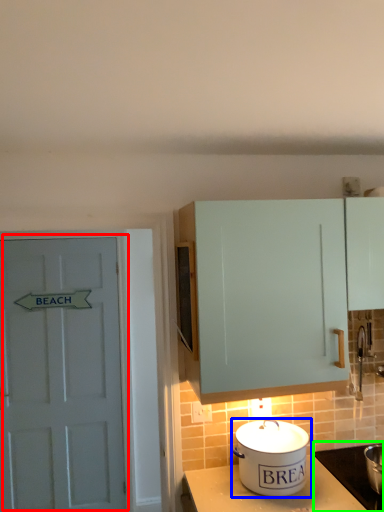
Question: Which object is positioned closest to door (highlighted by a red box)? Select from kitchen appliance (highlighted by a blue box) and appliance (highlighted by a green box).

Choices:
 (A) kitchen appliance
 (B) appliance

Answer: (A)